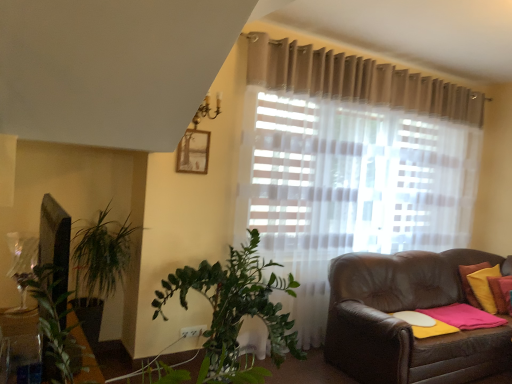
You are a GUI agent. You are given a task and a screenshot of the screen. Output one action in this format:
    pyautogui.click(x=<x>, y=<y>)
    Task: Click on the matte wooden picture frame at upper center
    The image size is (512, 384).
    Given the screenshot: What is the action you would take?
    pyautogui.click(x=193, y=152)

The width and height of the screenshot is (512, 384). In order to click on yellow fabric pillow at right, acting as the 1th pillow starting from the right in this screenshot , I will do `click(484, 287)`.

The width and height of the screenshot is (512, 384). What are the coordinates of `matte wooden picture frame at upper center` in the screenshot? It's located at coord(193,152).

Does matte wooden picture frame at upper center turn towards yellow fabric pillow at right, which is counted as the 2th pillow, starting from the right?

No, matte wooden picture frame at upper center does not turn towards yellow fabric pillow at right, which is counted as the 2th pillow, starting from the right.

How different are the orientations of matte wooden picture frame at upper center and yellow fabric pillow at right, which is counted as the 2th pillow, starting from the right, in degrees?

There is a 25.7-degree angle between the facing directions of matte wooden picture frame at upper center and yellow fabric pillow at right, which is counted as the 2th pillow, starting from the right.

How much distance is there between matte wooden picture frame at upper center and yellow fabric pillow at right, which ranks as the first pillow in left-to-right order?

matte wooden picture frame at upper center is 9.50 feet away from yellow fabric pillow at right, which ranks as the first pillow in left-to-right order.

Can you confirm if matte wooden picture frame at upper center is taller than yellow fabric pillow at right, which ranks as the first pillow in left-to-right order?

Incorrect, the height of matte wooden picture frame at upper center is not larger of that of yellow fabric pillow at right, which ranks as the first pillow in left-to-right order.

Is yellow fabric pillow at right, acting as the 1th pillow starting from the right, positioned before yellow fabric pillow at right, which is counted as the 2th pillow, starting from the right?

No, yellow fabric pillow at right, acting as the 1th pillow starting from the right, is behind yellow fabric pillow at right, which is counted as the 2th pillow, starting from the right.

Between yellow fabric pillow at right, acting as the 1th pillow starting from the right, and yellow fabric pillow at right, which ranks as the first pillow in left-to-right order, which one has less height?

Standing shorter between the two is yellow fabric pillow at right, which ranks as the first pillow in left-to-right order.

Can yellow fabric pillow at right, which ranks as the first pillow in left-to-right order, be found inside yellow fabric pillow at right, acting as the 1th pillow starting from the right?

Absolutely, yellow fabric pillow at right, which ranks as the first pillow in left-to-right order, is inside yellow fabric pillow at right, acting as the 1th pillow starting from the right.

From the picture: Based on their sizes in the image, would you say yellow fabric pillow at right, which appears as the second pillow when viewed from the left, is bigger or smaller than yellow fabric pillow at right, which ranks as the first pillow in left-to-right order?

Clearly, yellow fabric pillow at right, which appears as the second pillow when viewed from the left, is larger in size than yellow fabric pillow at right, which ranks as the first pillow in left-to-right order.

Can you confirm if matte wooden picture frame at upper center is thinner than yellow fabric pillow at right, which appears as the second pillow when viewed from the left?

Correct, the width of matte wooden picture frame at upper center is less than that of yellow fabric pillow at right, which appears as the second pillow when viewed from the left.

Would you say yellow fabric pillow at right, acting as the 1th pillow starting from the right, is part of matte wooden picture frame at upper center's contents?

That's incorrect, yellow fabric pillow at right, acting as the 1th pillow starting from the right, is not inside matte wooden picture frame at upper center.

How many degrees apart are the facing directions of matte wooden picture frame at upper center and yellow fabric pillow at right, which appears as the second pillow when viewed from the left?

matte wooden picture frame at upper center and yellow fabric pillow at right, which appears as the second pillow when viewed from the left, are facing 14.8 degrees away from each other.

Is matte wooden picture frame at upper center far from yellow fabric pillow at right, acting as the 1th pillow starting from the right?

matte wooden picture frame at upper center is positioned a significant distance from yellow fabric pillow at right, acting as the 1th pillow starting from the right.

Does yellow fabric pillow at right, which ranks as the first pillow in left-to-right order, turn towards matte wooden picture frame at upper center?

No, yellow fabric pillow at right, which ranks as the first pillow in left-to-right order, is not aimed at matte wooden picture frame at upper center.

From the image's perspective, which is below, yellow fabric pillow at right, which ranks as the first pillow in left-to-right order, or matte wooden picture frame at upper center?

yellow fabric pillow at right, which ranks as the first pillow in left-to-right order.

Are yellow fabric pillow at right, which is counted as the 2th pillow, starting from the right, and matte wooden picture frame at upper center making contact?

No, yellow fabric pillow at right, which is counted as the 2th pillow, starting from the right, is not beside matte wooden picture frame at upper center.

Which of these two, yellow fabric pillow at right, which is counted as the 2th pillow, starting from the right, or matte wooden picture frame at upper center, is smaller?

matte wooden picture frame at upper center is smaller.

Is yellow fabric pillow at right, which appears as the second pillow when viewed from the left, positioned far away from matte wooden picture frame at upper center?

yellow fabric pillow at right, which appears as the second pillow when viewed from the left, is positioned a significant distance from matte wooden picture frame at upper center.

Looking at this image, does yellow fabric pillow at right, acting as the 1th pillow starting from the right, have a larger size compared to matte wooden picture frame at upper center?

Correct, yellow fabric pillow at right, acting as the 1th pillow starting from the right, is larger in size than matte wooden picture frame at upper center.

Based on the photo, is yellow fabric pillow at right, acting as the 1th pillow starting from the right, turned away from matte wooden picture frame at upper center?

No, yellow fabric pillow at right, acting as the 1th pillow starting from the right, is not facing away from matte wooden picture frame at upper center.

What's the angular difference between yellow fabric pillow at right, acting as the 1th pillow starting from the right, and matte wooden picture frame at upper center's facing directions?

They differ by 14.8 degrees in their facing directions.

Can you confirm if yellow fabric pillow at right, which is counted as the 2th pillow, starting from the right, is shorter than yellow fabric pillow at right, acting as the 1th pillow starting from the right?

Indeed, yellow fabric pillow at right, which is counted as the 2th pillow, starting from the right, has a lesser height compared to yellow fabric pillow at right, acting as the 1th pillow starting from the right.

What's the angular difference between yellow fabric pillow at right, which ranks as the first pillow in left-to-right order, and yellow fabric pillow at right, acting as the 1th pillow starting from the right,'s facing directions?

There is a 10.9-degree angle between the facing directions of yellow fabric pillow at right, which ranks as the first pillow in left-to-right order, and yellow fabric pillow at right, acting as the 1th pillow starting from the right.

Which is behind, yellow fabric pillow at right, which is counted as the 2th pillow, starting from the right, or yellow fabric pillow at right, acting as the 1th pillow starting from the right?

yellow fabric pillow at right, acting as the 1th pillow starting from the right, is further from the camera.

From a real-world perspective, is yellow fabric pillow at right, which is counted as the 2th pillow, starting from the right, positioned above or below yellow fabric pillow at right, acting as the 1th pillow starting from the right?

In terms of real-world spatial position, yellow fabric pillow at right, which is counted as the 2th pillow, starting from the right, is above yellow fabric pillow at right, acting as the 1th pillow starting from the right.

From the image's perspective, which pillow is the 1st one below the matte wooden picture frame at upper center? Please provide its 2D coordinates.

[(500, 293)]

Identify the location of pillow on the left of yellow fabric pillow at right, which appears as the second pillow when viewed from the left. The image size is (512, 384). (500, 293).

Estimate the real-world distances between objects in this image. Which object is further from matte wooden picture frame at upper center, yellow fabric pillow at right, which appears as the second pillow when viewed from the left, or yellow fabric pillow at right, which is counted as the 2th pillow, starting from the right?

yellow fabric pillow at right, which is counted as the 2th pillow, starting from the right, lies further to matte wooden picture frame at upper center than the other object.

Looking at this image, which object lies nearer to the anchor point yellow fabric pillow at right, which is counted as the 2th pillow, starting from the right, matte wooden picture frame at upper center or yellow fabric pillow at right, acting as the 1th pillow starting from the right?

yellow fabric pillow at right, acting as the 1th pillow starting from the right, lies closer to yellow fabric pillow at right, which is counted as the 2th pillow, starting from the right, than the other object.

Estimate the real-world distances between objects in this image. Which object is closer to yellow fabric pillow at right, which is counted as the 2th pillow, starting from the right, yellow fabric pillow at right, which appears as the second pillow when viewed from the left, or matte wooden picture frame at upper center?

Based on the image, yellow fabric pillow at right, which appears as the second pillow when viewed from the left, appears to be nearer to yellow fabric pillow at right, which is counted as the 2th pillow, starting from the right.

Considering their positions, is yellow fabric pillow at right, which ranks as the first pillow in left-to-right order, positioned further to yellow fabric pillow at right, which appears as the second pillow when viewed from the left, than matte wooden picture frame at upper center?

Among the two, matte wooden picture frame at upper center is located further to yellow fabric pillow at right, which appears as the second pillow when viewed from the left.

Considering their positions, is matte wooden picture frame at upper center positioned closer to yellow fabric pillow at right, acting as the 1th pillow starting from the right, than yellow fabric pillow at right, which is counted as the 2th pillow, starting from the right?

yellow fabric pillow at right, which is counted as the 2th pillow, starting from the right.

When comparing their distances from matte wooden picture frame at upper center, does yellow fabric pillow at right, which is counted as the 2th pillow, starting from the right, or yellow fabric pillow at right, acting as the 1th pillow starting from the right, seem further?

yellow fabric pillow at right, which is counted as the 2th pillow, starting from the right, is positioned further to the anchor matte wooden picture frame at upper center.

Find the location of a particular element. This screenshot has width=512, height=384. pillow located between matte wooden picture frame at upper center and yellow fabric pillow at right, which appears as the second pillow when viewed from the left, in the left-right direction is located at coordinates pos(500,293).